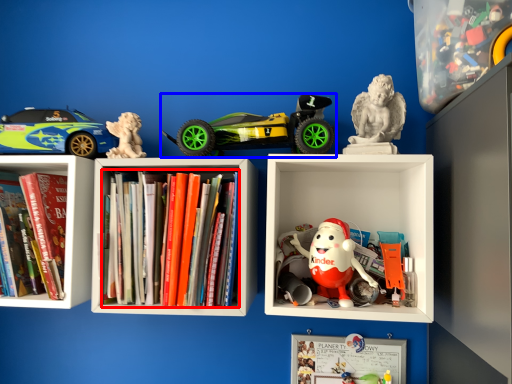
Question: Which object is closer to the camera taking this photo, book (highlighted by a red box) or toy (highlighted by a blue box)?

Choices:
 (A) book
 (B) toy

Answer: (A)